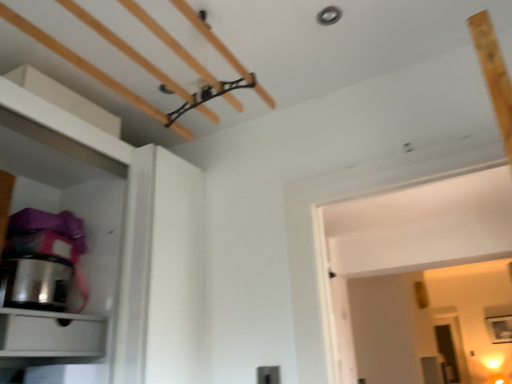
Image resolution: width=512 pixels, height=384 pixels. Identify the location of matte white drawer at lower left. (50, 336).

Measure the distance between point (83, 326) and camera.

Point (83, 326) is 4.74 feet from camera.

What do you see at coordinates (50, 336) in the screenshot? This screenshot has height=384, width=512. I see `matte white drawer at lower left` at bounding box center [50, 336].

Image resolution: width=512 pixels, height=384 pixels. In order to click on stainless steel pot at left in this screenshot , I will do `click(35, 283)`.

What do you see at coordinates (35, 283) in the screenshot? I see `stainless steel pot at left` at bounding box center [35, 283].

Identify the location of matte white drawer at lower left. This screenshot has width=512, height=384. (50, 336).

Can you confirm if matte white drawer at lower left is positioned to the right of stainless steel pot at left?

Indeed, matte white drawer at lower left is positioned on the right side of stainless steel pot at left.

In the image, is matte white drawer at lower left positioned in front of or behind stainless steel pot at left?

In the image, matte white drawer at lower left appears in front of stainless steel pot at left.

Which is less distant, (76,330) or (63,270)?

Positioned in front is point (76,330).

Based on the photo, from the image's perspective, would you say matte white drawer at lower left is shown under stainless steel pot at left?

Yes.

From a real-world perspective, is matte white drawer at lower left above or below stainless steel pot at left?

From a real-world perspective, matte white drawer at lower left is physically below stainless steel pot at left.

Which of these two, matte white drawer at lower left or stainless steel pot at left, is thinner?

Thinner between the two is stainless steel pot at left.

Considering the sizes of matte white drawer at lower left and stainless steel pot at left in the image, is matte white drawer at lower left taller or shorter than stainless steel pot at left?

Clearly, matte white drawer at lower left is shorter compared to stainless steel pot at left.

Does matte white drawer at lower left have a smaller size compared to stainless steel pot at left?

Indeed, matte white drawer at lower left has a smaller size compared to stainless steel pot at left.

Would you say matte white drawer at lower left is inside or outside stainless steel pot at left?

matte white drawer at lower left lies outside stainless steel pot at left.

Is matte white drawer at lower left touching stainless steel pot at left?

matte white drawer at lower left and stainless steel pot at left are not in contact.

Is stainless steel pot at left at the back of matte white drawer at lower left?

That's not correct — matte white drawer at lower left is not looking away from stainless steel pot at left.

Can you tell me how much matte white drawer at lower left and stainless steel pot at left differ in facing direction?

The facing directions of matte white drawer at lower left and stainless steel pot at left are 0.000605 degrees apart.

Find the location of a particular element. drawer that appears in front of the stainless steel pot at left is located at coordinates (50, 336).

Which is more to the left, stainless steel pot at left or matte white drawer at lower left?

stainless steel pot at left is more to the left.

Which object is closer to the camera, stainless steel pot at left or matte white drawer at lower left?

matte white drawer at lower left.

Considering the points (45, 290) and (55, 324), which point is in front, point (45, 290) or point (55, 324)?

The point (55, 324) is in front.

From the image's perspective, is stainless steel pot at left on top of matte white drawer at lower left?

Yes.

Consider the image. From a real-world perspective, does stainless steel pot at left stand above matte white drawer at lower left?

Yes, from a real-world perspective, stainless steel pot at left is above matte white drawer at lower left.

Does stainless steel pot at left have a lesser width compared to matte white drawer at lower left?

Correct, the width of stainless steel pot at left is less than that of matte white drawer at lower left.

Considering the relative sizes of stainless steel pot at left and matte white drawer at lower left in the image provided, is stainless steel pot at left taller than matte white drawer at lower left?

Correct, stainless steel pot at left is much taller as matte white drawer at lower left.

From the picture: Based on their sizes in the image, would you say stainless steel pot at left is bigger or smaller than matte white drawer at lower left?

Considering their sizes, stainless steel pot at left takes up more space than matte white drawer at lower left.

Consider the image. Does stainless steel pot at left contain matte white drawer at lower left?

No, matte white drawer at lower left is not inside stainless steel pot at left.

Are stainless steel pot at left and matte white drawer at lower left located far from each other?

No.

Is stainless steel pot at left turned away from matte white drawer at lower left?

No, stainless steel pot at left's orientation is not away from matte white drawer at lower left.

In the scene shown: Measure the distance from stainless steel pot at left to matte white drawer at lower left.

6.40 inches.

Locate an element on the screen. appliance above the matte white drawer at lower left (from a real-world perspective) is located at coordinates (35, 283).

In the image, there is a stainless steel pot at left. Find the location of `drawer below it (from a real-world perspective)`. drawer below it (from a real-world perspective) is located at coordinates (50, 336).

Image resolution: width=512 pixels, height=384 pixels. What are the coordinates of `appliance behind the matte white drawer at lower left` in the screenshot? It's located at (35, 283).